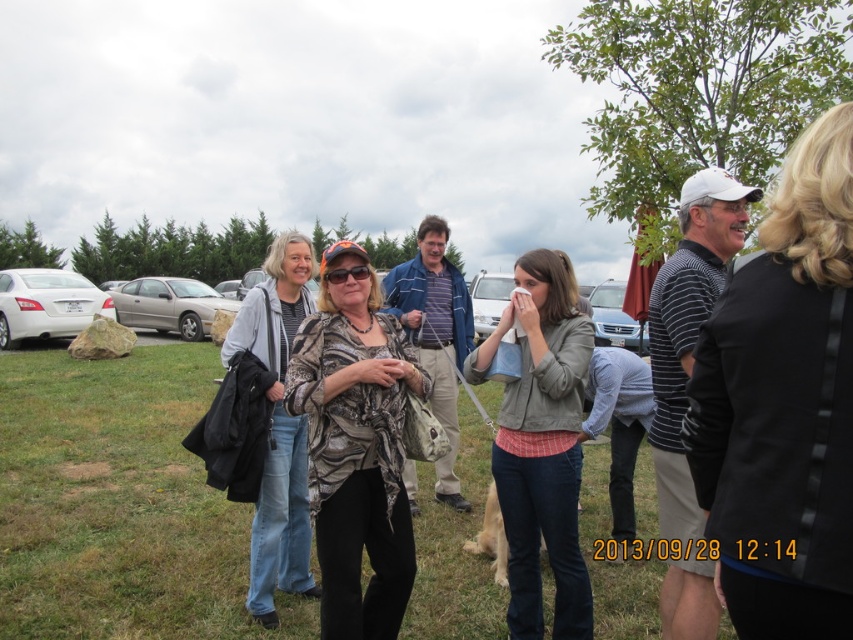
You are standing at the picnic area and want to take a photo of both the point at location [184,330] and the point at [489,307]. Which point should you focus on first to ensure both are in focus?

You should focus on the point at [184,330] first because it is closer to the camera than the point at [489,307]. This ensures that both points will be within the depth of field.

You are planning to park your car, which is 12 feet long, between the gold metallic sedan at left and the matte gray car at center. Is there enough space between them to park your car?

The gold metallic sedan at left and matte gray car at center are 32.38 feet apart. Since your car is 12 feet long, there is sufficient space between them to park your car.